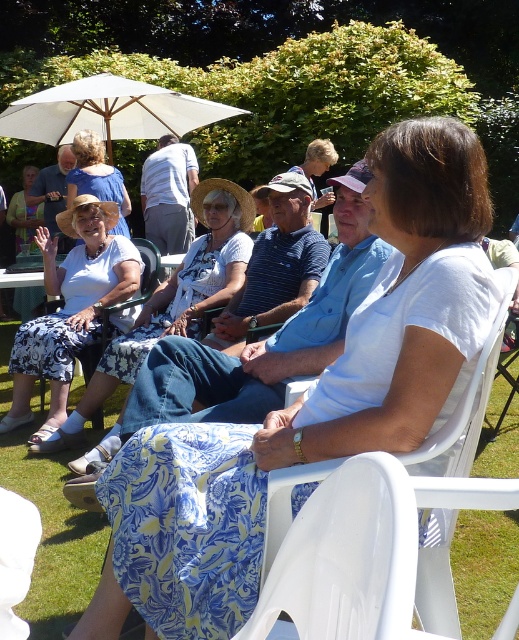
Question: Among these objects, which one is farthest from the camera?

Choices:
 (A) matte blue dress at center
 (B) white floral skirt at center

Answer: (A)

Question: Which point is closer to the camera?

Choices:
 (A) matte white blouse at center
 (B) white floral skirt at center
 (C) white fabric umbrella at upper left

Answer: (B)

Question: Does white floral skirt at center have a lesser width compared to matte white blouse at center?

Choices:
 (A) no
 (B) yes

Answer: (A)

Question: Which object is closer to the camera taking this photo?

Choices:
 (A) white plastic chair at center
 (B) white fabric dress at center
 (C) matte white blouse at center
 (D) matte blue dress at center

Answer: (A)

Question: Does white fabric dress at center have a lesser width compared to white plastic chair at center?

Choices:
 (A) no
 (B) yes

Answer: (A)

Question: Is the position of white floral skirt at center more distant than that of white fabric umbrella at upper left?

Choices:
 (A) yes
 (B) no

Answer: (B)